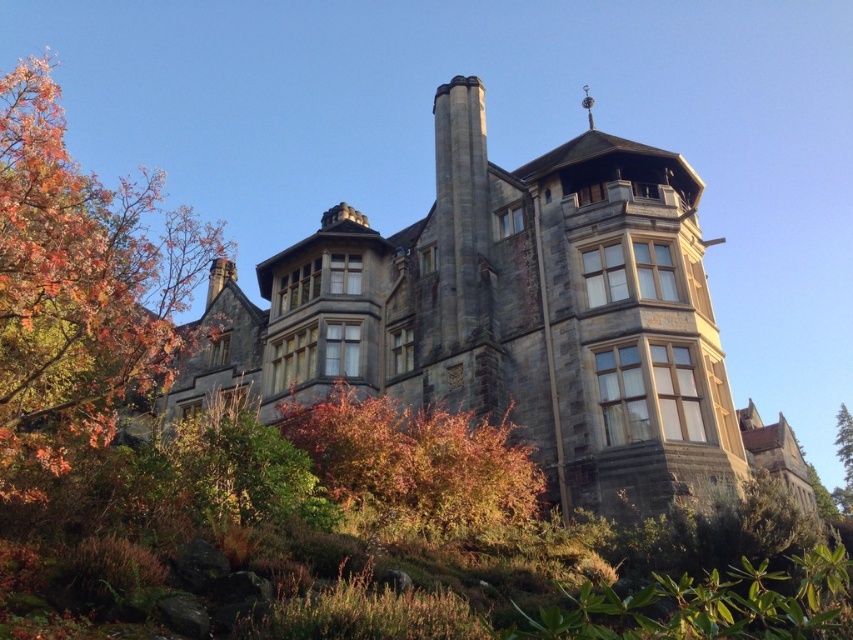
Based on the photo, is autumn leaves bush at center above green leafy tree at right?

Correct, autumn leaves bush at center is located above green leafy tree at right.

Is autumn leaves bush at center wider than green leafy tree at right?

No.

Find the location of `autumn leaves bush at center`. autumn leaves bush at center is located at coordinates (416, 461).

From the picture: Is autumn leaves at left to the left of autumn leaves bush at center from the viewer's perspective?

Correct, you'll find autumn leaves at left to the left of autumn leaves bush at center.

Can you confirm if autumn leaves at left is bigger than autumn leaves bush at center?

Yes.

Which is behind, point (88, 440) or point (450, 428)?

Positioned behind is point (450, 428).

Find the location of a particular element. The image size is (853, 640). autumn leaves at left is located at coordinates (79, 288).

Does autumn leaves at left have a greater width compared to green leafy tree at right?

Yes.

Does point (20, 202) come farther from viewer compared to point (850, 432)?

No, it is not.

Locate an element on the screen. This screenshot has height=640, width=853. autumn leaves at left is located at coordinates coord(79,288).